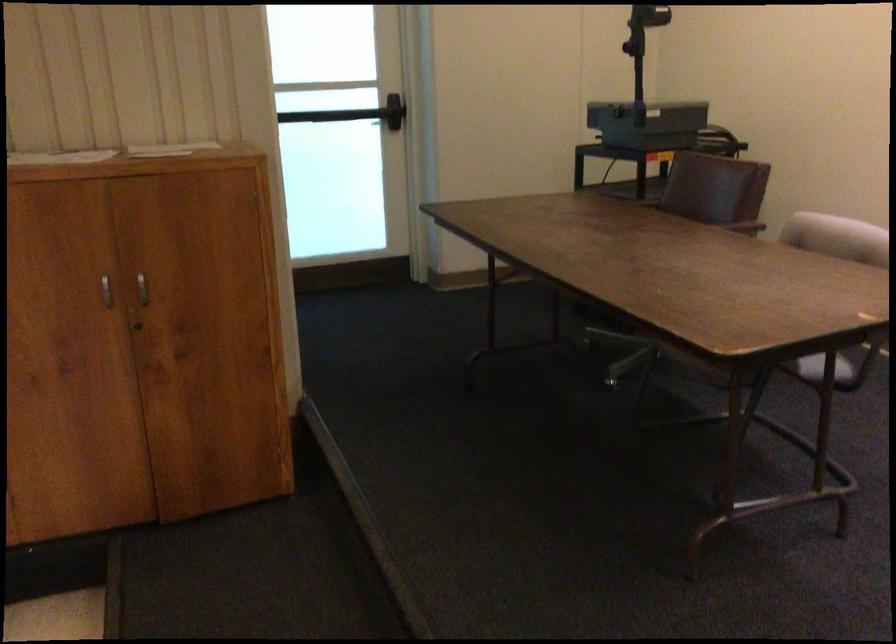
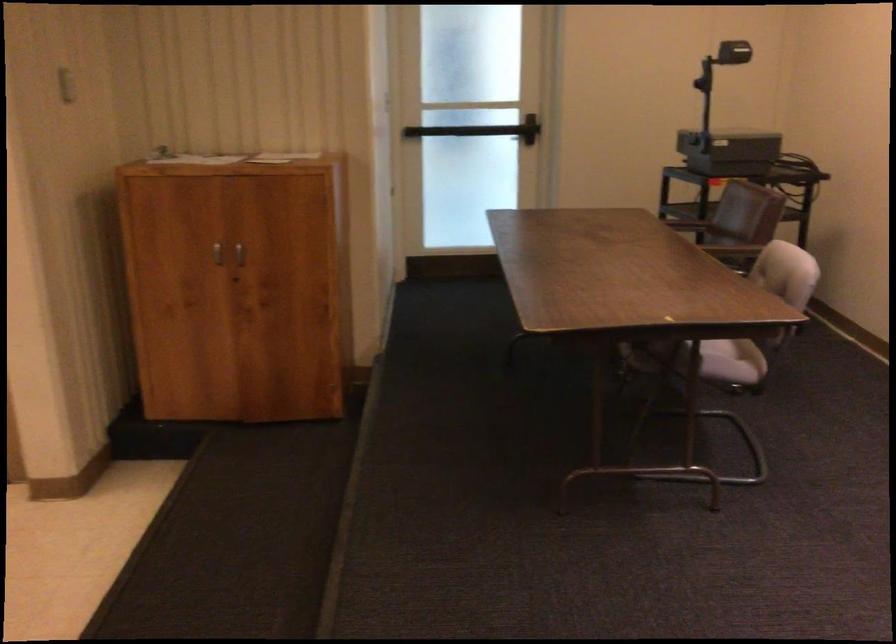
Where in the second image is the point corresponding to (144,297) from the first image?

(238, 258)